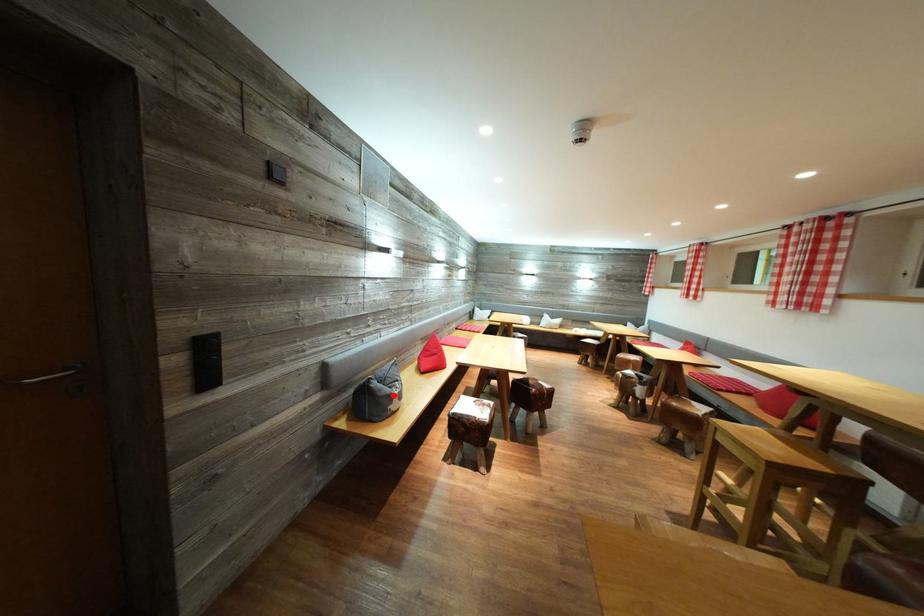
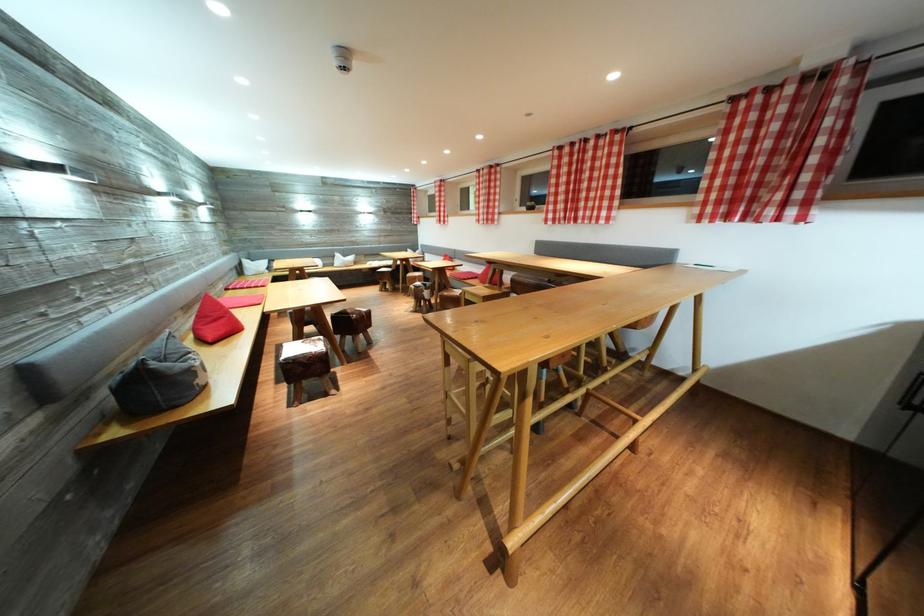
Question: I am providing you with two images of the same scene from different viewpoints. Given a red point in image1, look at the same physical point in image2. Is it:

Choices:
 (A) Closer to the viewpoint
 (B) Farther from the viewpoint

Answer: (B)